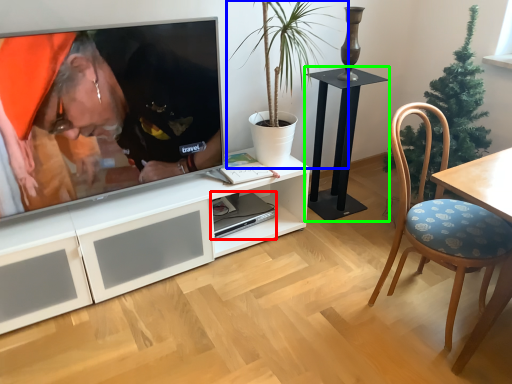
Question: Which object is the farthest from computer (highlighted by a red box)? Choose among these: houseplant (highlighted by a blue box) or table (highlighted by a green box).

Choices:
 (A) houseplant
 (B) table

Answer: (A)